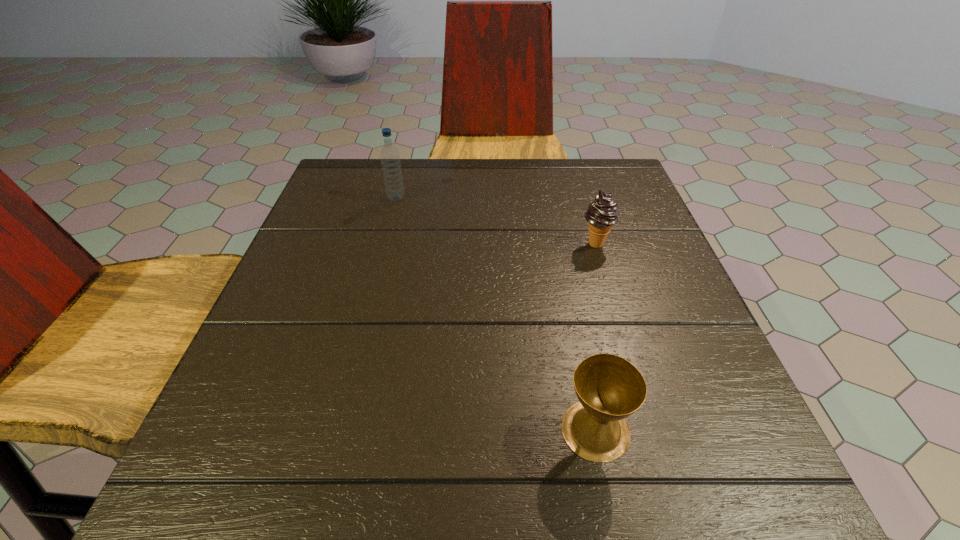
Find the location of a particular element. object positioned at the right edge is located at coordinates (601, 215).

I want to click on object present at the far left corner, so click(x=390, y=158).

In the image, there is a desktop. What are the coordinates of `free space at the far edge` in the screenshot? It's located at (560, 204).

Find the location of a particular element. This screenshot has width=960, height=540. free space at the near edge of the desktop is located at coordinates (629, 454).

Where is `vacant space at the left edge of the desktop`? The width and height of the screenshot is (960, 540). vacant space at the left edge of the desktop is located at coordinates (305, 388).

You are a GUI agent. You are given a task and a screenshot of the screen. Output one action in this format:
    pyautogui.click(x=<x>, y=<y>)
    Task: Click on the vacant space at the right edge of the desktop
    The height and width of the screenshot is (540, 960).
    Given the screenshot: What is the action you would take?
    pyautogui.click(x=663, y=258)

Find the location of a particular element. This screenshot has width=960, height=540. vacant area at the far right corner is located at coordinates (616, 198).

Locate an element on the screen. vacant space at the near right corner of the desktop is located at coordinates (777, 499).

You are a GUI agent. You are given a task and a screenshot of the screen. Output one action in this format:
    pyautogui.click(x=<x>, y=<y>)
    Task: Click on the vacant point located between the farthest object and the chalice
    Image resolution: width=960 pixels, height=540 pixels.
    Given the screenshot: What is the action you would take?
    pyautogui.click(x=496, y=314)

Where is `free space between the farthest object and the chalice`? The height and width of the screenshot is (540, 960). free space between the farthest object and the chalice is located at coordinates (496, 314).